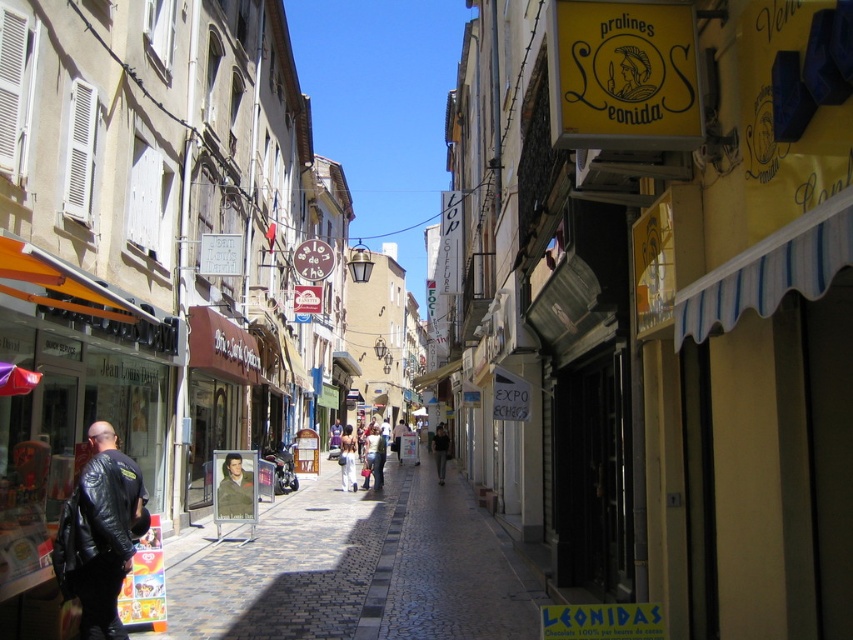
Question: Among these points, which one is nearest to the camera?

Choices:
 (A) (444, 442)
 (B) (102, 440)
 (C) (363, 467)

Answer: (B)

Question: Which point is closer to the camera taking this photo?

Choices:
 (A) (347, 582)
 (B) (73, 592)
 (C) (368, 458)

Answer: (B)

Question: Observing the image, what is the correct spatial positioning of khaki fabric jacket at center in reference to light blue jeans at center?

Choices:
 (A) above
 (B) below

Answer: (A)

Question: Does black leather jacket at lower left appear on the left side of dark gray sweater at center?

Choices:
 (A) yes
 (B) no

Answer: (A)

Question: Considering the relative positions of matte black signboard at center and light brown leather jacket at center in the image provided, where is matte black signboard at center located with respect to light brown leather jacket at center?

Choices:
 (A) below
 (B) above

Answer: (B)

Question: Among these objects, which one is nearest to the camera?

Choices:
 (A) light blue jeans at center
 (B) matte black signboard at center
 (C) light brown leather jacket at center
 (D) dark gray sweater at center

Answer: (B)